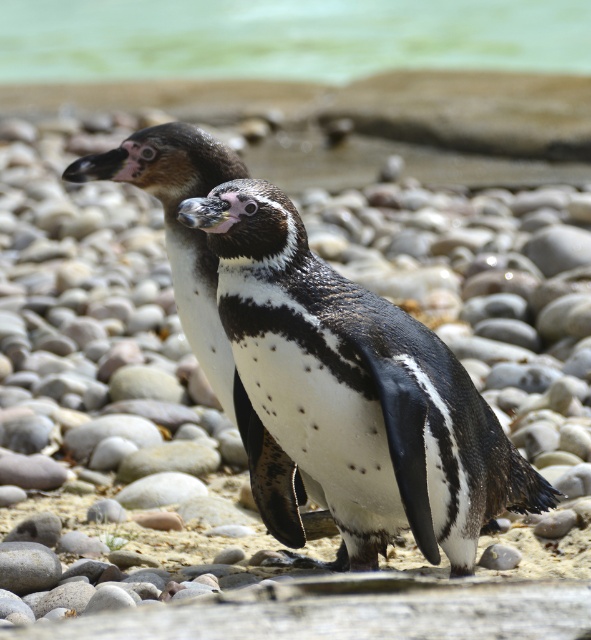
You are a photographer trying to capture a photo of the black and white penguin at center and the green water at upper center. Based on the scene, which object would appear smaller in your photo?

The black and white penguin at center appears smaller in the photo compared to the green water at upper center because the description states that the penguin has a smaller size compared to the green water at upper center.

Based on the scene description, where is the black and white penguin at center located in terms of coordinates?

The black and white penguin at center is located at coordinates point [320,365].